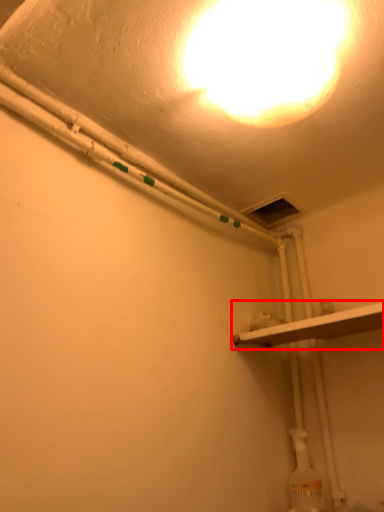
Question: From the image's perspective, where is shelf (annotated by the red box) located relative to lamp?

Choices:
 (A) below
 (B) above

Answer: (A)